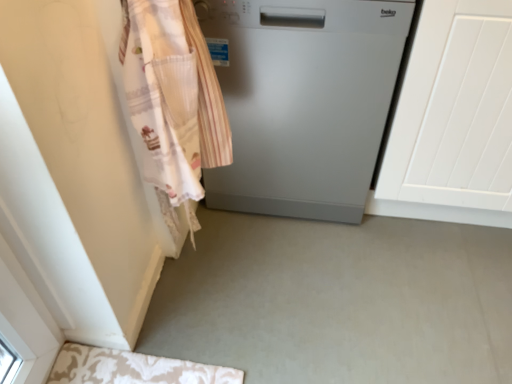
Where is `white textured door at right`? This screenshot has height=384, width=512. white textured door at right is located at coordinates (453, 119).

Identify the location of white lace apron at left. This screenshot has height=384, width=512. (173, 101).

Locate an element on the screen. This screenshot has width=512, height=384. white textured door at right is located at coordinates (453, 119).

Are white textured door at right and satin silver dishwasher at center located far from each other?

That's not correct — white textured door at right is a little close to satin silver dishwasher at center.

Considering the relative positions of white textured door at right and satin silver dishwasher at center in the image provided, is white textured door at right to the left or to the right of satin silver dishwasher at center?

In the image, white textured door at right appears on the right side of satin silver dishwasher at center.

Does point (499, 226) come in front of point (386, 100)?

No, (499, 226) is behind (386, 100).

Would you say white textured door at right is inside or outside satin silver dishwasher at center?

white textured door at right is located beyond the bounds of satin silver dishwasher at center.

Does white lace apron at left turn towards satin silver dishwasher at center?

No, white lace apron at left is not facing towards satin silver dishwasher at center.

Does white lace apron at left have a greater height compared to satin silver dishwasher at center?

Yes.

Between white lace apron at left and satin silver dishwasher at center, which one appears on the left side from the viewer's perspective?

white lace apron at left is more to the left.

Is white lace apron at left situated inside satin silver dishwasher at center or outside?

white lace apron at left cannot be found inside satin silver dishwasher at center.

Relative to white lace apron at left, is satin silver dishwasher at center in front or behind?

Clearly, satin silver dishwasher at center is behind white lace apron at left.

From the image's perspective, relative to white lace apron at left, is satin silver dishwasher at center above or below?

satin silver dishwasher at center is above white lace apron at left.

Is satin silver dishwasher at center bigger than white lace apron at left?

Indeed, satin silver dishwasher at center has a larger size compared to white lace apron at left.

Considering the positions of objects satin silver dishwasher at center and white lace apron at left in the image provided, who is more to the right, satin silver dishwasher at center or white lace apron at left?

satin silver dishwasher at center.

From the image's perspective, is satin silver dishwasher at center beneath white textured door at right?

Incorrect, from the image's perspective, satin silver dishwasher at center is higher than white textured door at right.

Is satin silver dishwasher at center at the left side of white textured door at right?

Indeed, satin silver dishwasher at center is positioned on the left side of white textured door at right.

Is satin silver dishwasher at center closer to camera compared to white textured door at right?

No, satin silver dishwasher at center is further to the viewer.

From a real-world perspective, which is physically below, satin silver dishwasher at center or white textured door at right?

satin silver dishwasher at center.

The width and height of the screenshot is (512, 384). Find the location of `screen door located behind the white lace apron at left`. screen door located behind the white lace apron at left is located at coordinates (453, 119).

From a real-world perspective, which object stands above the other?

From a 3D spatial view, white lace apron at left is above.

From the image's perspective, relative to white textured door at right, is white lace apron at left above or below?

Clearly, from the image's perspective, white lace apron at left is below white textured door at right.

Is white lace apron at left taller than white textured door at right?

Correct, white lace apron at left is much taller as white textured door at right.

Is white textured door at right inside or outside of white lace apron at left?

white textured door at right is not inside white lace apron at left, it's outside.

Find the location of a particular element. screen door above the white lace apron at left (from the image's perspective) is located at coordinates (453, 119).

Which is less distant, (400, 112) or (210, 127)?

Point (400, 112) appears to be farther away from the viewer than point (210, 127).

Is white textured door at right facing towards white lace apron at left?

No, white textured door at right is not facing towards white lace apron at left.

Locate an element on the screen. The height and width of the screenshot is (384, 512). home appliance that appears on the left of white textured door at right is located at coordinates (303, 101).

I want to click on home appliance located on the right of white lace apron at left, so click(303, 101).

Considering their positions, is white lace apron at left positioned further to satin silver dishwasher at center than white textured door at right?

The object further to satin silver dishwasher at center is white lace apron at left.

Estimate the real-world distances between objects in this image. Which object is closer to white textured door at right, white lace apron at left or satin silver dishwasher at center?

satin silver dishwasher at center lies closer to white textured door at right than the other object.

Which object lies nearer to the anchor point satin silver dishwasher at center, white textured door at right or white lace apron at left?

white textured door at right is positioned closer to the anchor satin silver dishwasher at center.

Considering their positions, is satin silver dishwasher at center positioned closer to white lace apron at left than white textured door at right?

The object closer to white lace apron at left is satin silver dishwasher at center.

Consider the image. Estimate the real-world distances between objects in this image. Which object is further from white lace apron at left, white textured door at right or satin silver dishwasher at center?

Based on the image, white textured door at right appears to be further to white lace apron at left.

When comparing their distances from white textured door at right, does satin silver dishwasher at center or white lace apron at left seem further?

Based on the image, white lace apron at left appears to be further to white textured door at right.

Where is `home appliance situated between white lace apron at left and white textured door at right from left to right`? This screenshot has width=512, height=384. home appliance situated between white lace apron at left and white textured door at right from left to right is located at coordinates (303, 101).